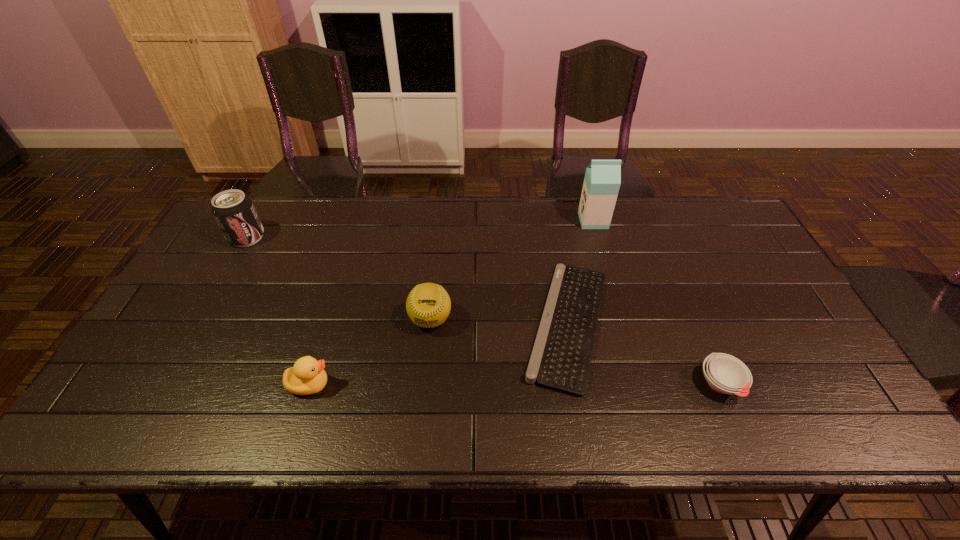
Identify the location of free spot between the shortest object and the soup bowl. (644, 354).

The height and width of the screenshot is (540, 960). Find the location of `empty space that is in between the tallest object and the duck`. empty space that is in between the tallest object and the duck is located at coordinates (451, 302).

You are a GUI agent. You are given a task and a screenshot of the screen. Output one action in this format:
    pyautogui.click(x=<x>, y=<y>)
    Task: Click on the free spot between the softball and the computer keyboard
    The image size is (960, 540).
    Given the screenshot: What is the action you would take?
    pyautogui.click(x=499, y=322)

You are a GUI agent. You are given a task and a screenshot of the screen. Output one action in this format:
    pyautogui.click(x=<x>, y=<y>)
    Task: Click on the free space that is in between the rightmost object and the duck
    The image size is (960, 540).
    Given the screenshot: What is the action you would take?
    pyautogui.click(x=516, y=384)

You are a GUI agent. You are given a task and a screenshot of the screen. Output one action in this format:
    pyautogui.click(x=<x>, y=<y>)
    Task: Click on the vacant space that is in between the leftmost object and the duck
    Image resolution: width=960 pixels, height=540 pixels.
    Given the screenshot: What is the action you would take?
    pyautogui.click(x=278, y=311)

Where is `free space between the fifth object from right to left and the fifth tallest object`? The image size is (960, 540). free space between the fifth object from right to left and the fifth tallest object is located at coordinates (516, 384).

Identify the location of unoccupied area between the shortest object and the second object from left to right. (439, 354).

You are a GUI agent. You are given a task and a screenshot of the screen. Output one action in this format:
    pyautogui.click(x=<x>, y=<y>)
    Task: Click on the object that is the fifth closest to the shortest object
    
    Given the screenshot: What is the action you would take?
    pyautogui.click(x=234, y=212)

This screenshot has height=540, width=960. Find the location of `object that is the second closest to the duck`. object that is the second closest to the duck is located at coordinates (561, 357).

I want to click on free space that satisfies the following two spatial constraints: 1. on the front side of the tallest object; 2. at the beak of the duck, so (x=639, y=384).